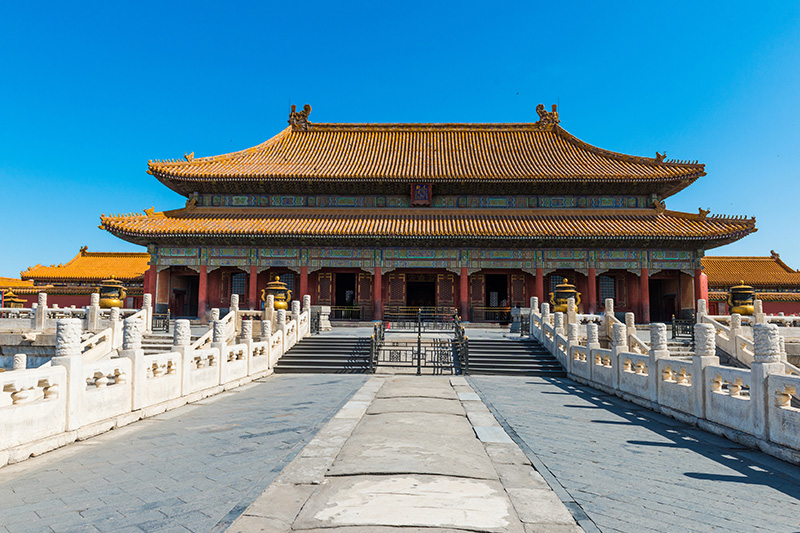
Where is `red walls`? red walls is located at coordinates (64, 300), (782, 309).